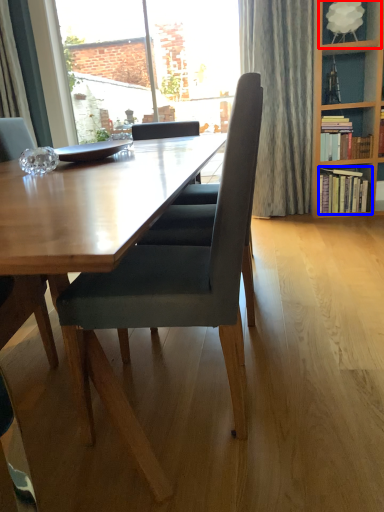
Question: Which of the following is the closest to the observer, shelf (highlighted by a red box) or book (highlighted by a blue box)?

Choices:
 (A) shelf
 (B) book

Answer: (A)